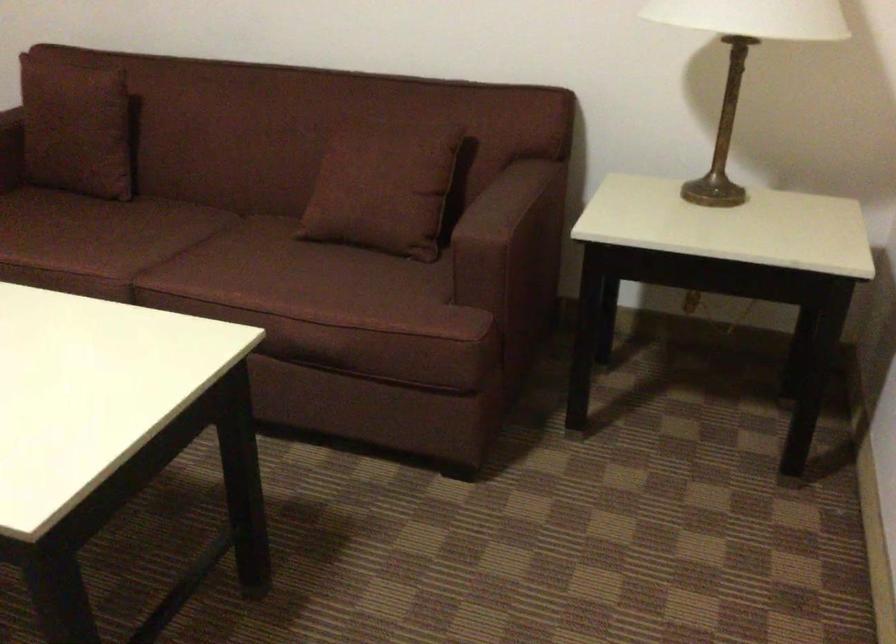
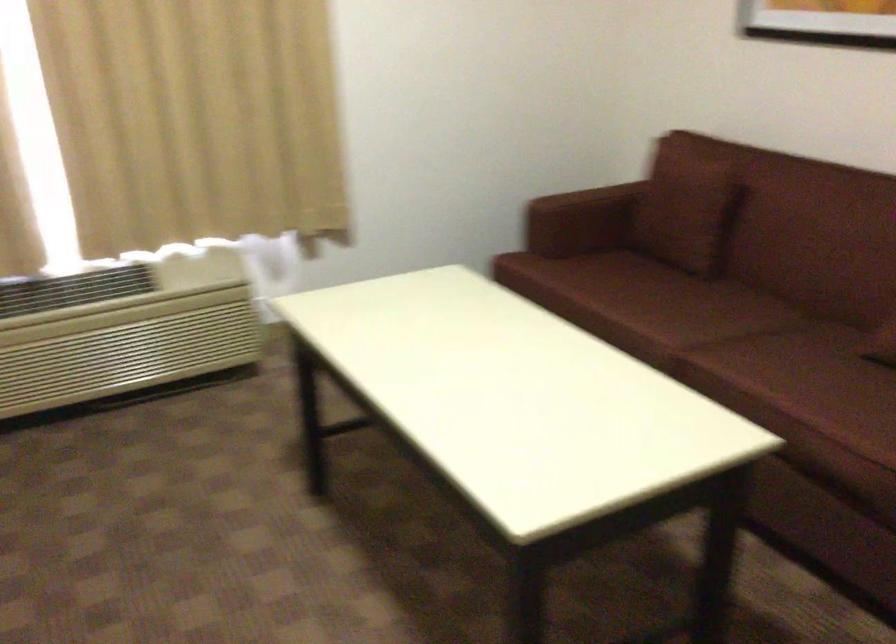
Question: Based on the continuous images, in which direction is the camera rotating? Reply with the corresponding letter.

Choices:
 (A) Left
 (B) Right
 (C) Up
 (D) Down

Answer: (A)